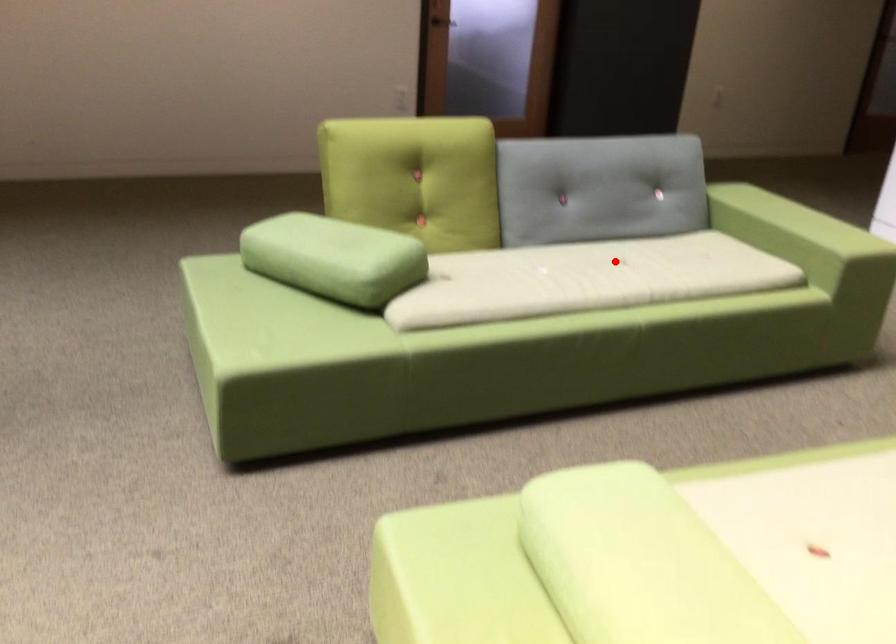
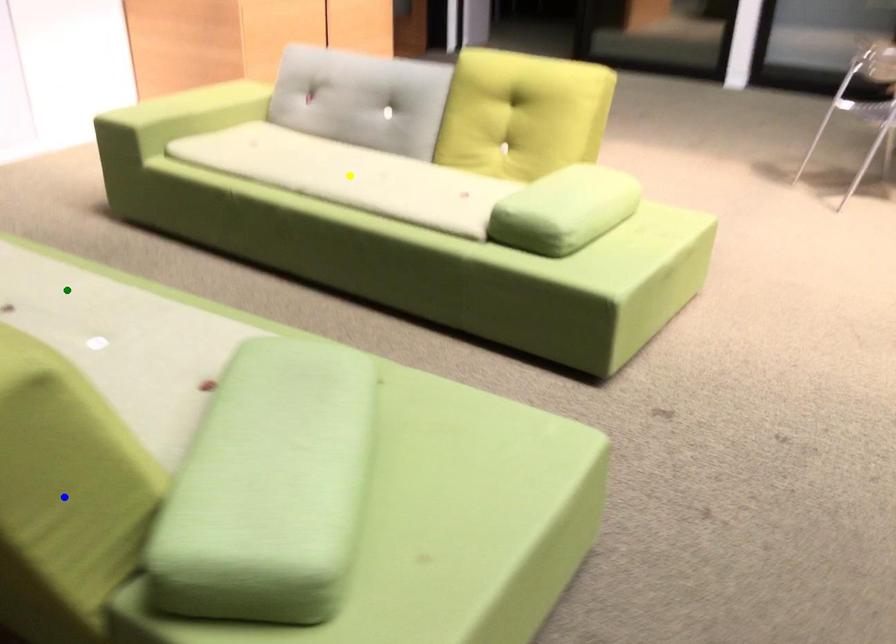
Question: I am providing you with two images of the same scene from different viewpoints. A red point is marked on the first image. You are given multiple points on the second image. Can you choose the point in image 2 that corresponds to the point in image 1?

Choices:
 (A) blue point
 (B) yellow point
 (C) green point

Answer: (C)